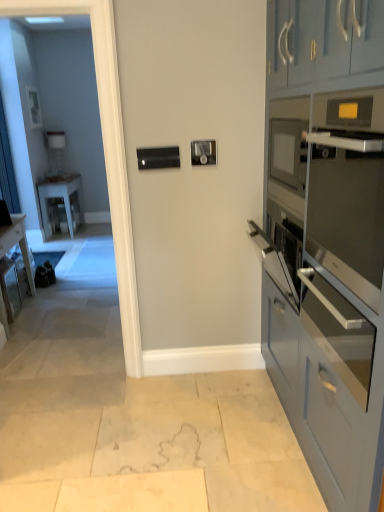
Question: From a real-world perspective, is white glossy table at left physically located above or below satin silver oven at right, which is the first oven in top-to-bottom order?

Choices:
 (A) below
 (B) above

Answer: (A)

Question: Which is correct: white glossy table at left is inside satin silver oven at right, which is the second oven from bottom to top, or outside of it?

Choices:
 (A) outside
 (B) inside

Answer: (A)

Question: Which of these objects is positioned farthest from the satin silver oven at right, which is the first oven in top-to-bottom order?

Choices:
 (A) white glossy table at left
 (B) transparent glass door at left
 (C) matte blue cabinets at right
 (D) wooden desk at left
 (E) satin silver oven at right, the 1th oven positioned from the bottom

Answer: (A)

Question: Estimate the real-world distances between objects in this image. Which object is farther from the wooden desk at left?

Choices:
 (A) white glossy table at left
 (B) transparent glass door at left
 (C) satin silver oven at right, which is the first oven in top-to-bottom order
 (D) matte blue cabinets at right
 (E) satin silver oven at right, the 1th oven positioned from the bottom

Answer: (C)